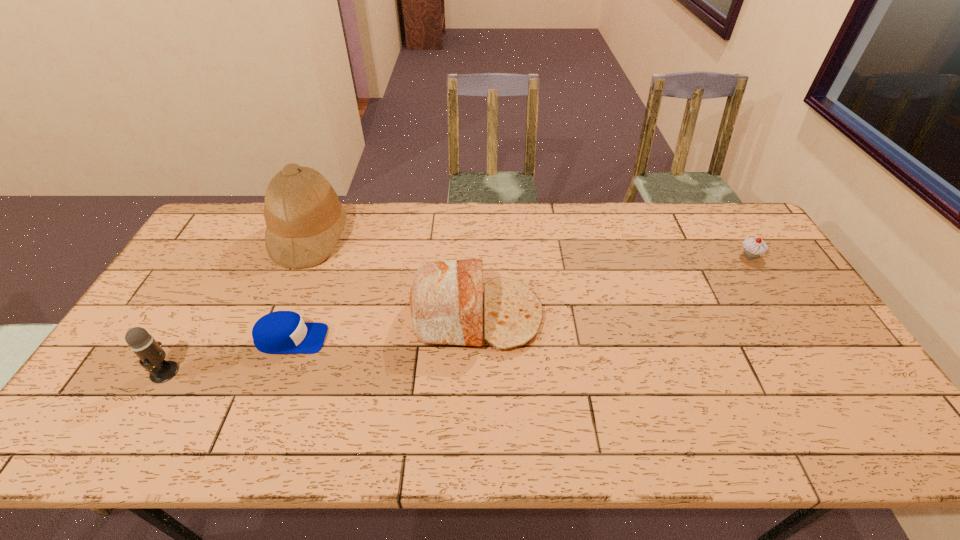
Locate an element on the screen. The height and width of the screenshot is (540, 960). free space located on the back of the rightmost object is located at coordinates (723, 213).

The height and width of the screenshot is (540, 960). Identify the location of vacant point located on the front-facing side of the baseball cap. (396, 339).

The height and width of the screenshot is (540, 960). What are the coordinates of `object present at the far edge` in the screenshot? It's located at tap(304, 218).

The height and width of the screenshot is (540, 960). Find the location of `object located in the left edge section of the desktop`. object located in the left edge section of the desktop is located at coordinates (150, 352).

You are a GUI agent. You are given a task and a screenshot of the screen. Output one action in this format:
    pyautogui.click(x=<x>, y=<y>)
    Task: Click on the object that is at the right edge
    
    Given the screenshot: What is the action you would take?
    pyautogui.click(x=753, y=247)

What are the coordinates of `vacant space at the far edge` in the screenshot? It's located at (495, 243).

Identify the location of blank area at the near edge. This screenshot has height=540, width=960. (798, 428).

Where is `free location at the right edge of the desktop`? The width and height of the screenshot is (960, 540). free location at the right edge of the desktop is located at coordinates tap(804, 325).

Find the location of a particular element. The height and width of the screenshot is (540, 960). vacant space at the far left corner of the desktop is located at coordinates 218,224.

This screenshot has width=960, height=540. What are the coordinates of `free space between the bread and the rightmost object` in the screenshot? It's located at (614, 286).